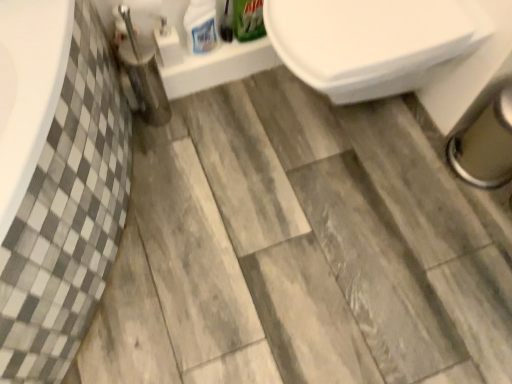
Find the location of a particular element. This screenshot has width=512, height=384. free spot to the right of brushed metal toilet brush at lower left is located at coordinates (209, 120).